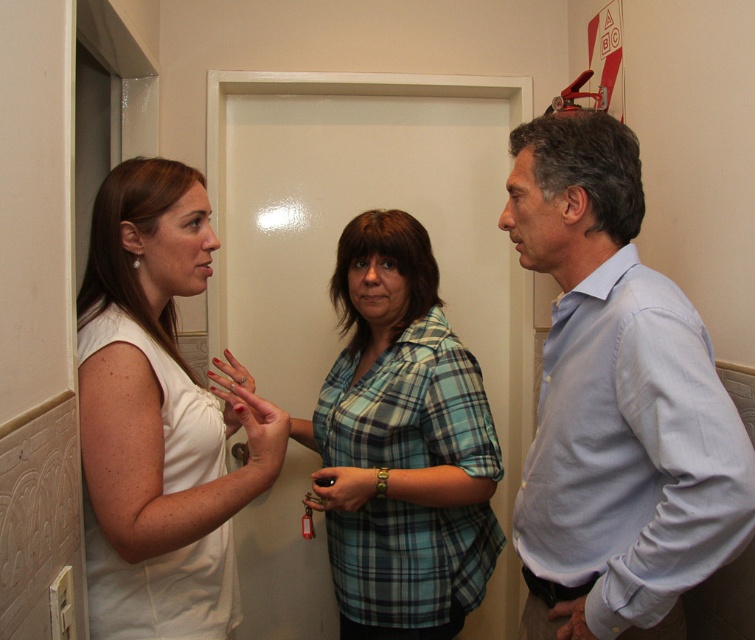
You are standing in the hallway and want to move from point A to point B. Point A is at coordinate point (347,497) and point B is at coordinate point (566,605). Which point is closer to you?

Point A at coordinate point (347,497) is closer to you because it is further to the camera than point B at coordinate point (566,605).

You are a security guard checking the credentials of two people in the hallway. You notice the matte brown leather wallet at center and the smooth skin hand at lower center. Which object is larger in size?

The matte brown leather wallet at center is bigger than the smooth skin hand at lower center, so the wallet is larger.

You are a delivery person with a box that is 1.5 meters long. You need to pass between the two people in the hallway. The plaid fabric shirt at center and the woman in sleeveless white top at left. Can you fit through the space between them?

The two people are 1.42 meters apart, which is less than the length of your 1.5 meter box. Therefore, you cannot safely pass through the space between the plaid fabric shirt at center and the woman in sleeveless white top at left.